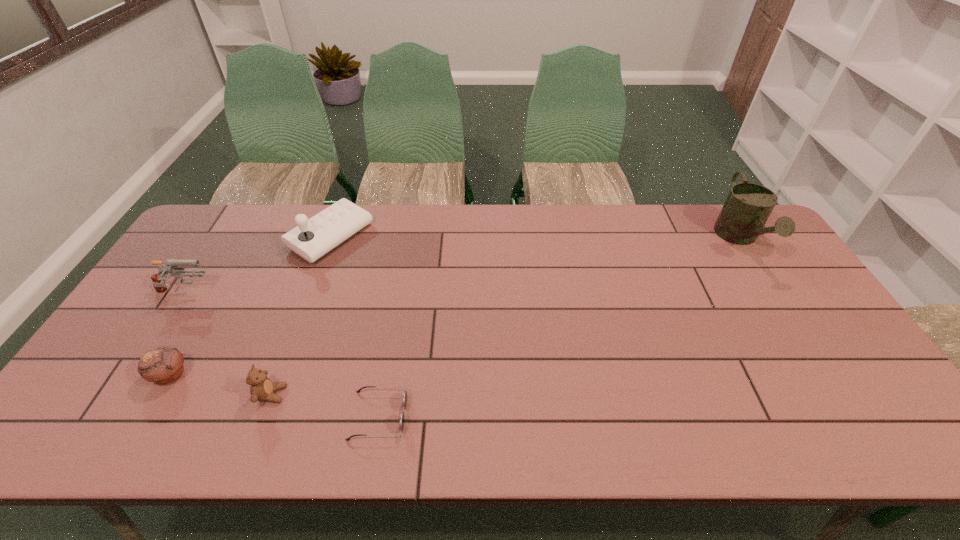
Locate an element on the screen. free space between the shortest object and the teddy bear is located at coordinates (325, 405).

I want to click on unoccupied area between the fourth nearest object and the sunglasses, so click(281, 355).

Find the location of a particular element. free space between the muffin and the teddy bear is located at coordinates pos(221,384).

Where is `vacant area that lies between the gun and the teddy bear`? This screenshot has width=960, height=540. vacant area that lies between the gun and the teddy bear is located at coordinates (228, 344).

The height and width of the screenshot is (540, 960). What are the coordinates of `vacant point located between the second shortest object and the watering can` in the screenshot? It's located at (455, 307).

The image size is (960, 540). What are the coordinates of `empty space that is in between the fourth tallest object and the rightmost object` in the screenshot? It's located at (506, 317).

Select which object appears as the fourth closest to the watering can. Please provide its 2D coordinates. Your answer should be formatted as a tuple, i.e. [(x, y)], where the tuple contains the x and y coordinates of a point satisfying the conditions above.

[(163, 365)]

Select which object appears as the fourth closest to the rightmost object. Please provide its 2D coordinates. Your answer should be formatted as a tuple, i.e. [(x, y)], where the tuple contains the x and y coordinates of a point satisfying the conditions above.

[(163, 365)]

The image size is (960, 540). I want to click on vacant region that satisfies the following two spatial constraints: 1. on the front side of the joystick; 2. at the barrel end of the fourth nearest object, so click(x=309, y=294).

The image size is (960, 540). Find the location of `vacant region that satisfies the following two spatial constraints: 1. with the spout on the tallest object; 2. at the barrel end of the gun`. vacant region that satisfies the following two spatial constraints: 1. with the spout on the tallest object; 2. at the barrel end of the gun is located at coordinates (775, 294).